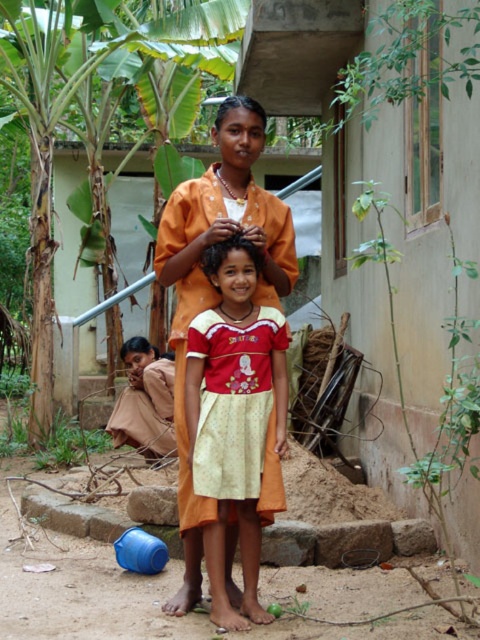
Question: Which point is closer to the camera taking this photo?

Choices:
 (A) (214, 28)
 (B) (126, 346)
 (C) (220, 257)
 (D) (264, 122)

Answer: (C)

Question: In this image, where is black shiny hair at upper center located relative to brown silky hair at upper center?

Choices:
 (A) above
 (B) below

Answer: (A)

Question: Considering the real-world distances, which object is farthest from the brown silky hair at upper center?

Choices:
 (A) black shiny hair at upper center
 (B) green leafy banana tree at upper left

Answer: (A)

Question: Among these objects, which one is nearest to the camera?

Choices:
 (A) brown silky hair at upper center
 (B) brown silky hair at center
 (C) red cotton dress at center
 (D) black shiny hair at upper center

Answer: (C)

Question: Does green leafy banana tree at upper left have a larger size compared to brown silky hair at center?

Choices:
 (A) yes
 (B) no

Answer: (A)

Question: Is red cotton dress at center smaller than green leafy banana tree at upper left?

Choices:
 (A) yes
 (B) no

Answer: (A)